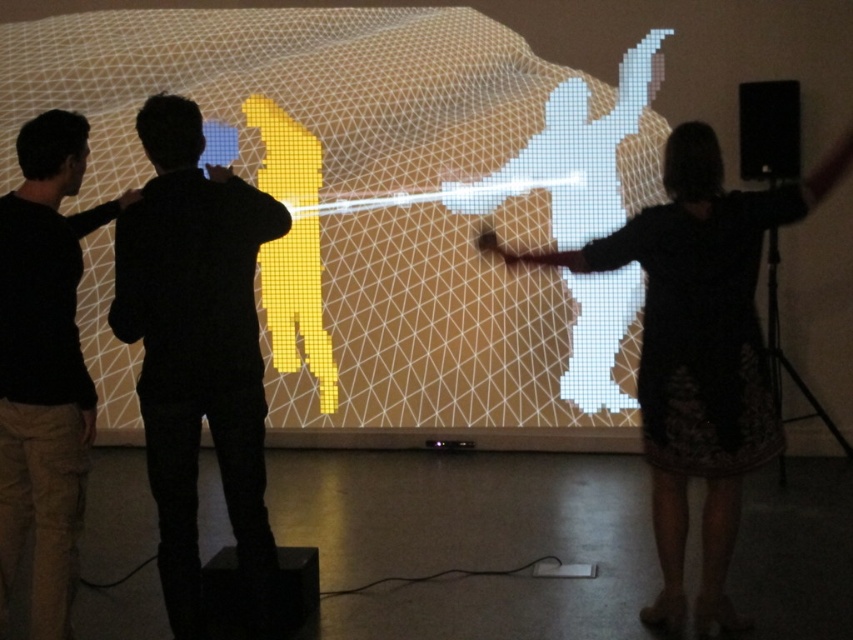
You are an art curator planning to adjust the layout of the installation. The yellow pixelated figure at center and the black matte shirt at left are part of the exhibit. Which object is positioned higher in the scene?

The yellow pixelated figure at center is located above the black matte shirt at left, so it is positioned higher in the scene.

You are standing in the room where the digital projection is displayed. There is a silhouette man at center marked by point (198, 353). If you walk towards the projection wall, will you pass through the point marking the silhouette man at center?

Yes, walking towards the projection wall, you will pass through the point marking the silhouette man at center because the point is located at the center of the wall.